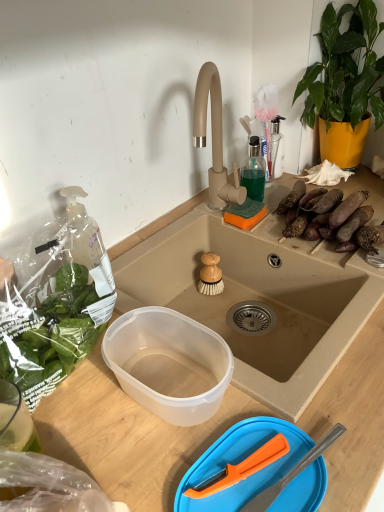
The image size is (384, 512). What are the coordinates of `vacant space in front of translucent glass bottle at upper center` in the screenshot? It's located at (274, 230).